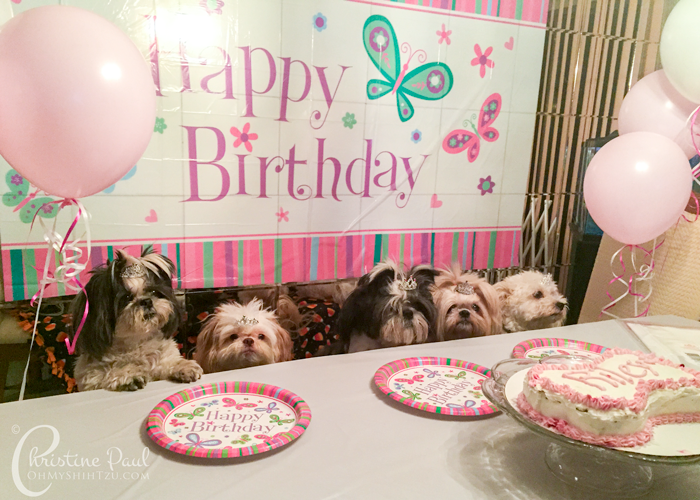
Where is `"happy birthday" written in large lavender colored letters on white banner`? Image resolution: width=700 pixels, height=500 pixels. "happy birthday" written in large lavender colored letters on white banner is located at coordinates (248, 90), (288, 157).